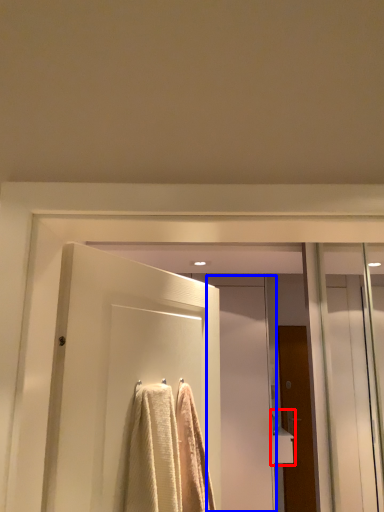
Question: Which of the following is the closest to the observer, sink (highlighted by a red box) or screen door (highlighted by a blue box)?

Choices:
 (A) sink
 (B) screen door

Answer: (B)